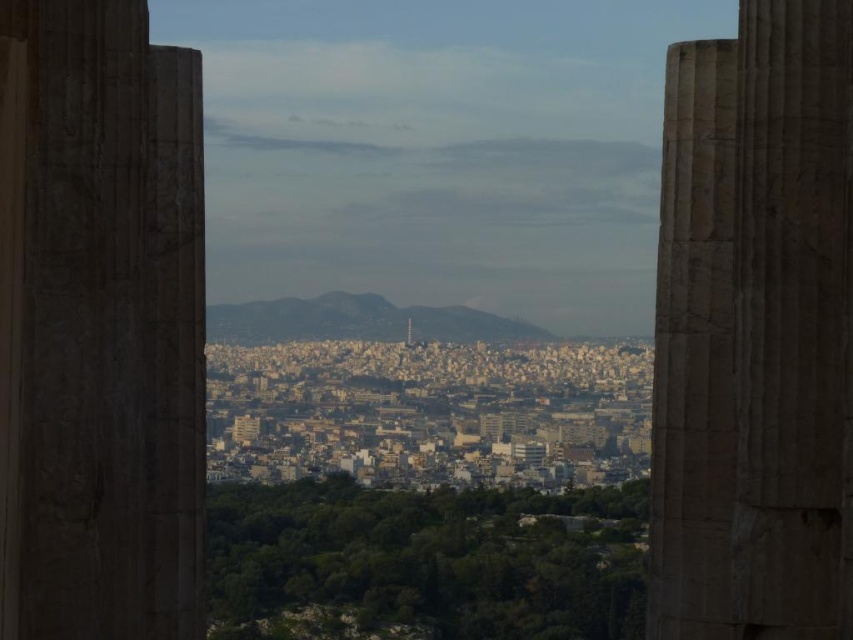
Is carved stone column at left smaller than marble column at right?

Actually, carved stone column at left might be larger than marble column at right.

Which is more to the left, carved stone column at left or marble column at right?

From the viewer's perspective, carved stone column at left appears more on the left side.

Where is `carved stone column at left`? The image size is (853, 640). carved stone column at left is located at coordinates (99, 324).

The height and width of the screenshot is (640, 853). In order to click on carved stone column at left in this screenshot , I will do `click(99, 324)`.

Does carved stone column at left have a greater height compared to marble column at center?

No, carved stone column at left is not taller than marble column at center.

Is carved stone column at left shorter than marble column at center?

Yes, carved stone column at left is shorter than marble column at center.

Does point (85, 115) come behind point (799, 74)?

That is False.

Find the location of a particular element. carved stone column at left is located at coordinates pos(99,324).

Can you confirm if marble column at center is positioned to the right of marble column at right?

Yes, marble column at center is to the right of marble column at right.

Is point (767, 492) positioned behind point (653, 465)?

Yes, point (767, 492) is farther from viewer.

What are the coordinates of `marble column at center` in the screenshot? It's located at point(753,330).